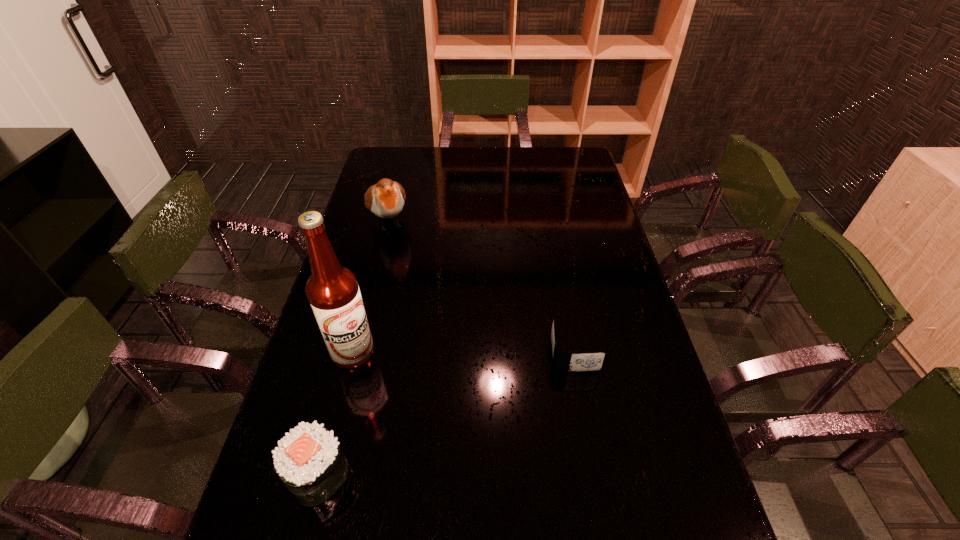
Image resolution: width=960 pixels, height=540 pixels. Find the location of `vacant space on the desktop that is between the sushi and the wallet and is positioned on the label side of the tallest object`. vacant space on the desktop that is between the sushi and the wallet and is positioned on the label side of the tallest object is located at coordinates (465, 406).

Locate an element on the screen. free space on the desktop that is between the nearest object and the shortest object and is positioned at the face of the third shortest object is located at coordinates (469, 403).